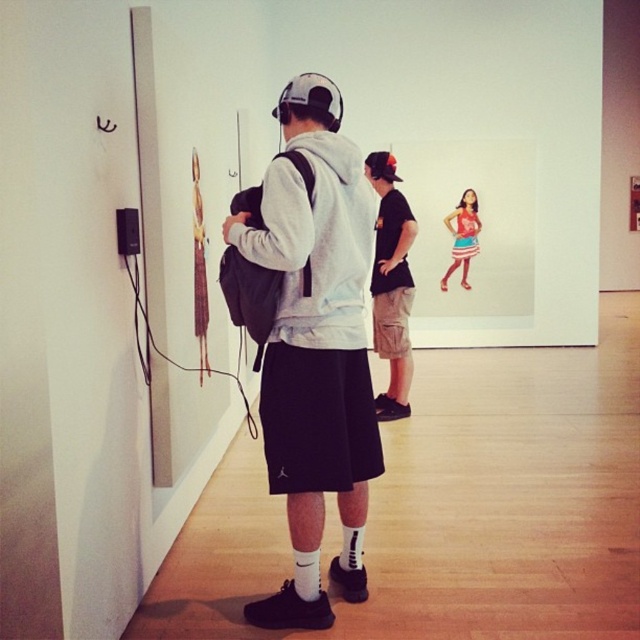
You are standing in the art gallery and want to move from the point closer to you to the point further away. Which path would you take between the two points, point(272,280) and point(444,221)?

The path from point(272,280) to point(444,221) would involve moving towards the point that is further away, as point(272,280) is closer to the viewer than point(444,221).